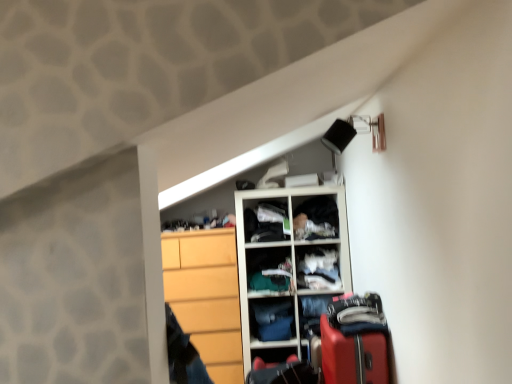
Question: Considering their positions, is white plastic cabinet at upper center, the 2th cabinet from the bottom, located in front of or behind white fabric at center, which is the 2th cabinet from top to bottom?

Choices:
 (A) front
 (B) behind

Answer: (B)

Question: From their relative heights in the image, would you say white plastic cabinet at upper center, arranged as the 1th cabinet when viewed from the left, is taller or shorter than white fabric at center, which is the 2th cabinet from top to bottom?

Choices:
 (A) tall
 (B) short

Answer: (B)

Question: Estimate the real-world distances between objects in this image. Which object is farther from the wooden dresser at lower left?

Choices:
 (A) dark blue fabric at center
 (B) white plastic cabinet at upper center, the 2th cabinet from the bottom
 (C) white wooden cupboard at center
 (D) denim pants at center, acting as the 1th clothing starting from the left
 (E) dark gray fabric at upper center, positioned as the second clothing in left-to-right order

Answer: (E)

Question: Estimate the real-world distances between objects in this image. Which object is farther from the white fabric at center, the 1th cabinet when ordered from right to left?

Choices:
 (A) dark gray fabric at upper center, which is counted as the 2th clothing, starting from the bottom
 (B) dark blue fabric at center
 (C) rubberized red suitcase at lower right, which ranks as the second luggage in bottom-to-top order
 (D) white wooden cupboard at center
 (E) denim pants at center, which is counted as the first clothing, starting from the bottom

Answer: (C)